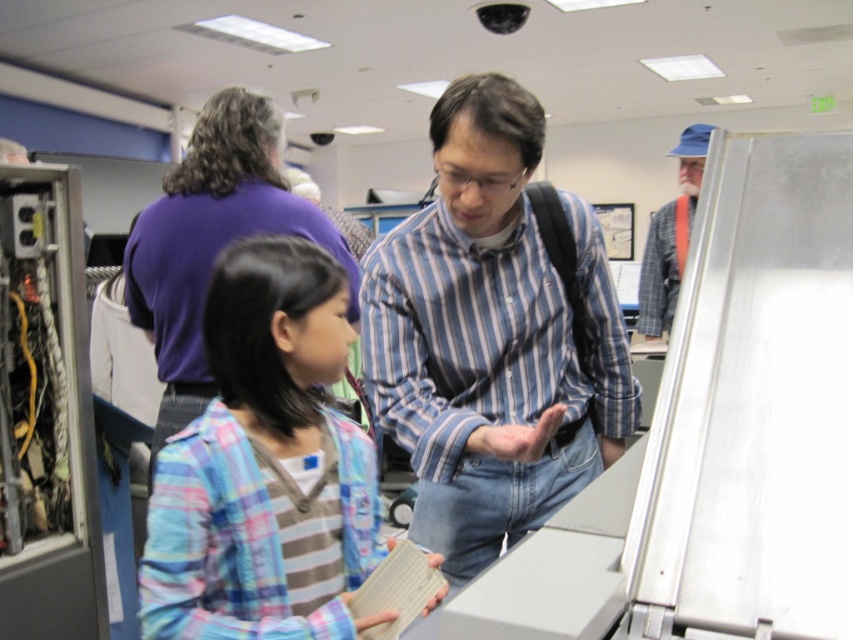
Question: Which object is farther from the camera taking this photo?

Choices:
 (A) blue plaid shirt at upper right
 (B) blue striped shirt at center
 (C) plaid fabric shirt at center

Answer: (A)

Question: Is plaid fabric shirt at center smaller than blue plaid shirt at upper right?

Choices:
 (A) no
 (B) yes

Answer: (B)

Question: Estimate the real-world distances between objects in this image. Which object is closer to the blue striped shirt at center?

Choices:
 (A) plaid fabric shirt at center
 (B) blue plaid shirt at upper right

Answer: (A)

Question: Considering the relative positions of blue striped shirt at center and blue plaid shirt at upper right in the image provided, where is blue striped shirt at center located with respect to blue plaid shirt at upper right?

Choices:
 (A) left
 (B) right

Answer: (A)

Question: Does blue striped shirt at center have a lesser width compared to blue plaid shirt at upper right?

Choices:
 (A) no
 (B) yes

Answer: (A)

Question: Which point is farther to the camera?

Choices:
 (A) (222, 513)
 (B) (695, 200)

Answer: (B)